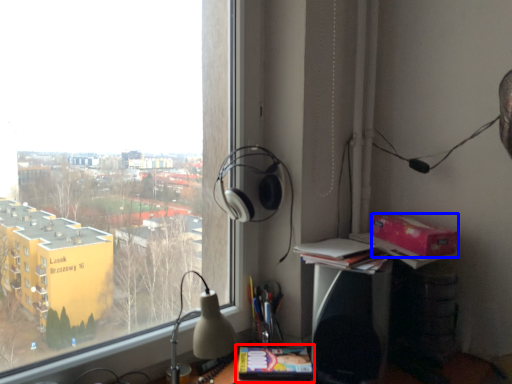
Question: Which of the following is the closest to the observer, paperback book (highlighted by a red box) or cardboard box (highlighted by a blue box)?

Choices:
 (A) paperback book
 (B) cardboard box

Answer: (A)